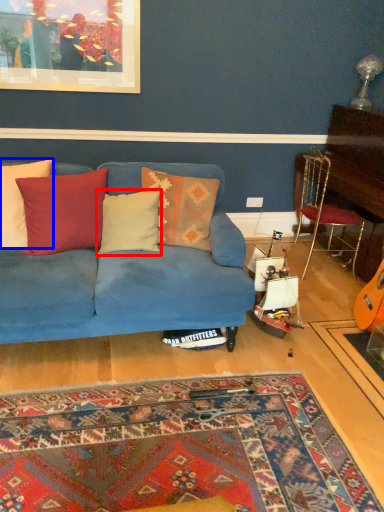
Question: Which object is further to the camera taking this photo, pillow (highlighted by a red box) or pillow (highlighted by a blue box)?

Choices:
 (A) pillow
 (B) pillow

Answer: (A)